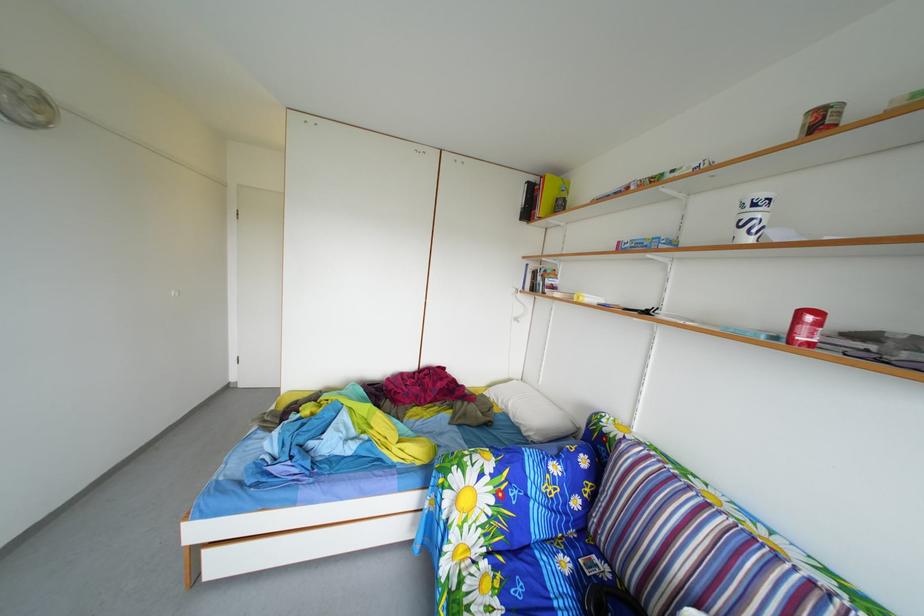
Image resolution: width=924 pixels, height=616 pixels. Describe the element at coordinates (553, 578) in the screenshot. I see `the sofa sitting surface` at that location.